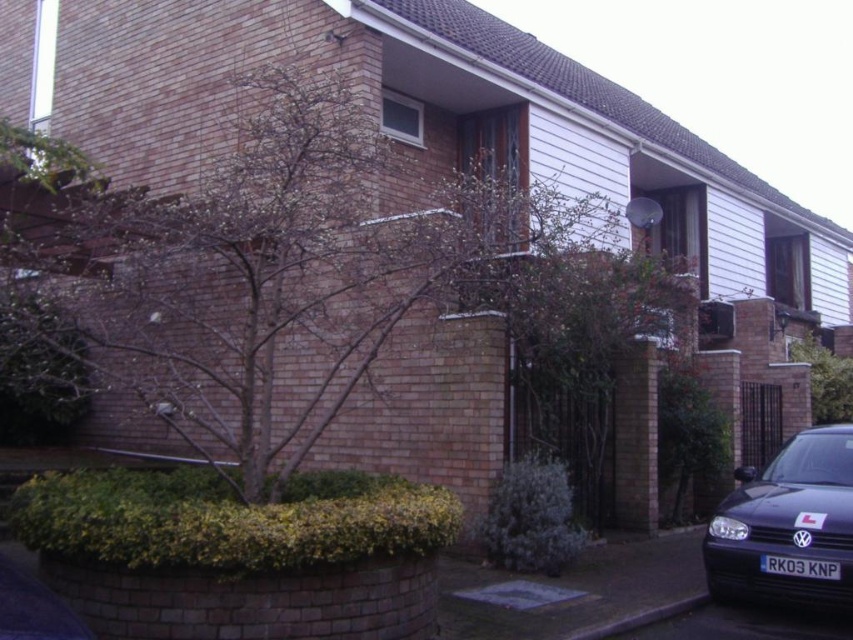
Does matte black car at lower right have a lesser height compared to green leafy tree at center?

Yes.

Based on the photo, is the position of matte black car at lower right more distant than that of green leafy tree at center?

No, it is not.

The height and width of the screenshot is (640, 853). I want to click on matte black car at lower right, so click(787, 525).

Where is `matte black car at lower right`? The image size is (853, 640). matte black car at lower right is located at coordinates (787, 525).

Measure the distance between matte black car at lower right and black plastic license plate at lower right.

23.21 inches

How far apart are matte black car at lower right and black plastic license plate at lower right?

They are 23.21 inches apart.

The height and width of the screenshot is (640, 853). Find the location of `matte black car at lower right`. matte black car at lower right is located at coordinates (787, 525).

Is green leafy tree at center wider than black plastic license plate at lower right?

Yes.

Which of these two, green leafy tree at center or black plastic license plate at lower right, stands shorter?

With less height is black plastic license plate at lower right.

Where is `green leafy tree at center`? green leafy tree at center is located at coordinates (825, 378).

The image size is (853, 640). I want to click on green leafy tree at center, so click(x=825, y=378).